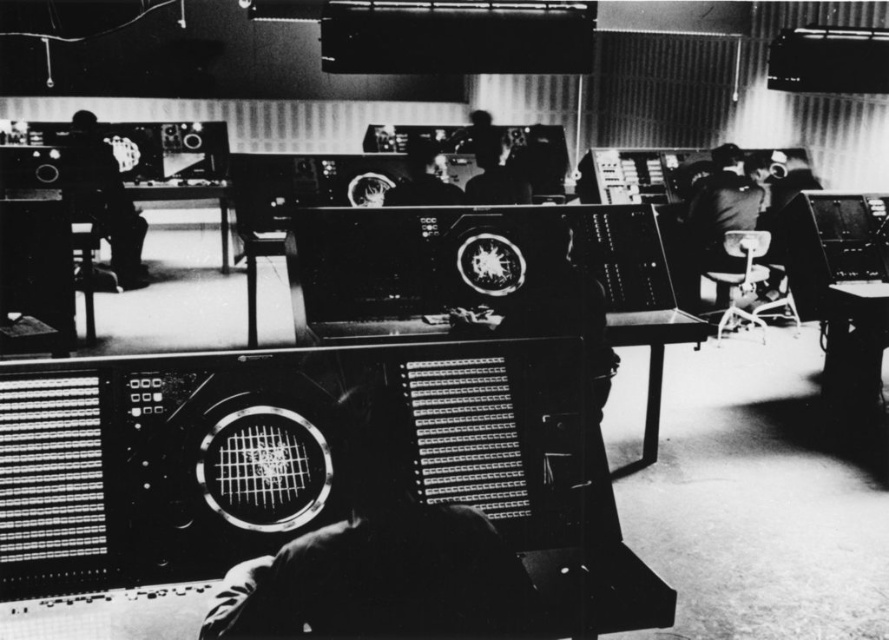
Does point (321, 634) come behind point (87, 176)?

No.

Is point (430, 621) farther from camera compared to point (89, 161)?

No, (430, 621) is closer to viewer.

Find the location of a particular element. This screenshot has width=889, height=640. metallic panel at center is located at coordinates (380, 556).

Is point (127, 195) farther from camera compared to point (399, 193)?

Yes, point (127, 195) is farther from viewer.

Looking at this image, who is lower down, silhouette of person at left or smooth black head at center?

silhouette of person at left

Locate an element on the screen. The image size is (889, 640). silhouette of person at left is located at coordinates (108, 200).

Between metallic panel at center and smooth black head at center, which one appears on the left side from the viewer's perspective?

From the viewer's perspective, smooth black head at center appears more on the left side.

Which is above, metallic panel at center or smooth black head at center?

Positioned higher is smooth black head at center.

Does point (255, 604) lie in front of point (419, 193)?

That is True.

This screenshot has height=640, width=889. Find the location of `metallic panel at center`. metallic panel at center is located at coordinates (380, 556).